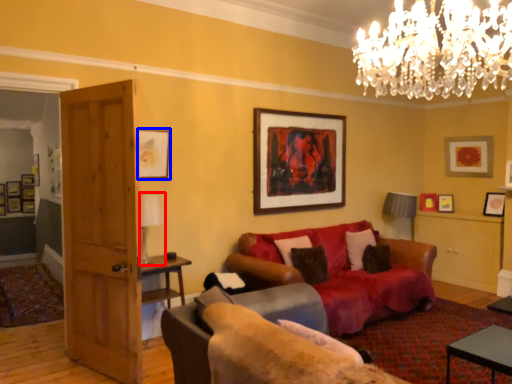
Question: Among these objects, which one is nearest to the camera, lamp (highlighted by a red box) or picture frame (highlighted by a blue box)?

Choices:
 (A) lamp
 (B) picture frame

Answer: (A)